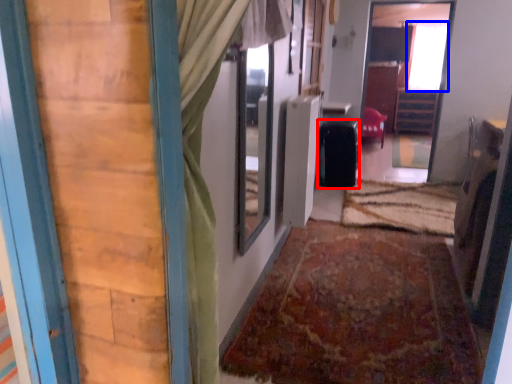
Question: Which object appears closest to the camera in this image, luggage (highlighted by a red box) or window (highlighted by a blue box)?

Choices:
 (A) luggage
 (B) window

Answer: (A)